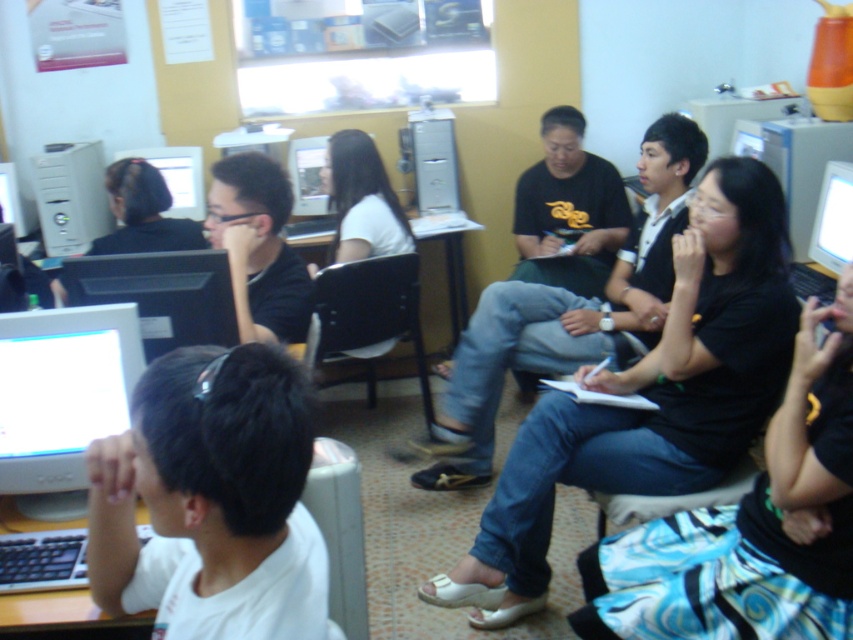
Is white matte shirt at left closer to the viewer compared to matte plastic monitor at center?

That is True.

Who is more forward, (216, 560) or (321, 136)?

Point (216, 560) is more forward.

Locate an element on the screen. Image resolution: width=853 pixels, height=640 pixels. white matte shirt at left is located at coordinates (212, 499).

Who is positioned more to the right, white plastic tower at left or matte black monitor at upper left?

matte black monitor at upper left

Which is behind, point (67, 182) or point (195, 173)?

Positioned behind is point (195, 173).

Identify the location of white plastic tower at left. (70, 196).

Can you confirm if white matte shirt at center is positioned above bright white plastic monitor at upper right?

Indeed, white matte shirt at center is positioned over bright white plastic monitor at upper right.

Can you confirm if white matte shirt at center is wider than bright white plastic monitor at upper right?

Indeed, white matte shirt at center has a greater width compared to bright white plastic monitor at upper right.

Locate an element on the screen. This screenshot has height=640, width=853. white matte shirt at center is located at coordinates (361, 200).

I want to click on white matte shirt at center, so click(x=361, y=200).